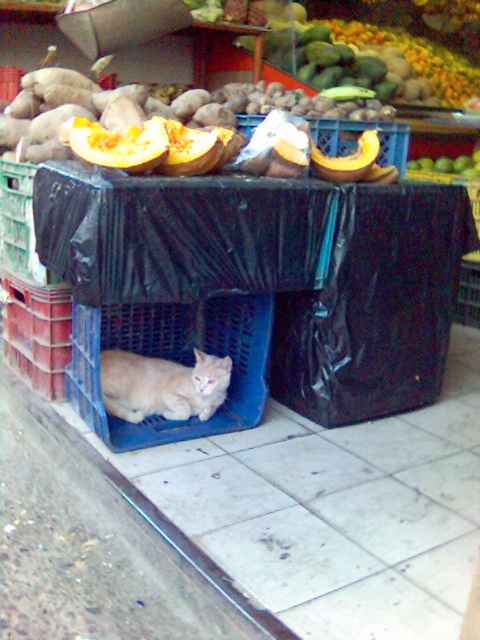
Consider the image. Who is shorter, blue plastic crate at center or orange fleshed squash at center?

With less height is orange fleshed squash at center.

Is blue plastic crate at center positioned at the back of orange fleshed squash at center?

Yes, it is.

Which is behind, point (252, 333) or point (159, 154)?

The point (252, 333) is behind.

Where is `blue plastic crate at center`? The width and height of the screenshot is (480, 640). blue plastic crate at center is located at coordinates (172, 360).

Is point (88, 317) less distant than point (175, 163)?

No, (88, 317) is further to viewer.

What do you see at coordinates (172, 360) in the screenshot? I see `blue plastic crate at center` at bounding box center [172, 360].

Image resolution: width=480 pixels, height=640 pixels. Identify the location of blue plastic crate at center. (172, 360).

Which is more to the left, orange fleshed squash at center or yellow matte pumpkin at center?

From the viewer's perspective, orange fleshed squash at center appears more on the left side.

Between point (98, 140) and point (364, 168), which one is positioned behind?

Point (364, 168)

Is point (109, 132) behind point (372, 134)?

No, (109, 132) is in front of (372, 134).

Where is `orange fleshed squash at center`? orange fleshed squash at center is located at coordinates (118, 145).